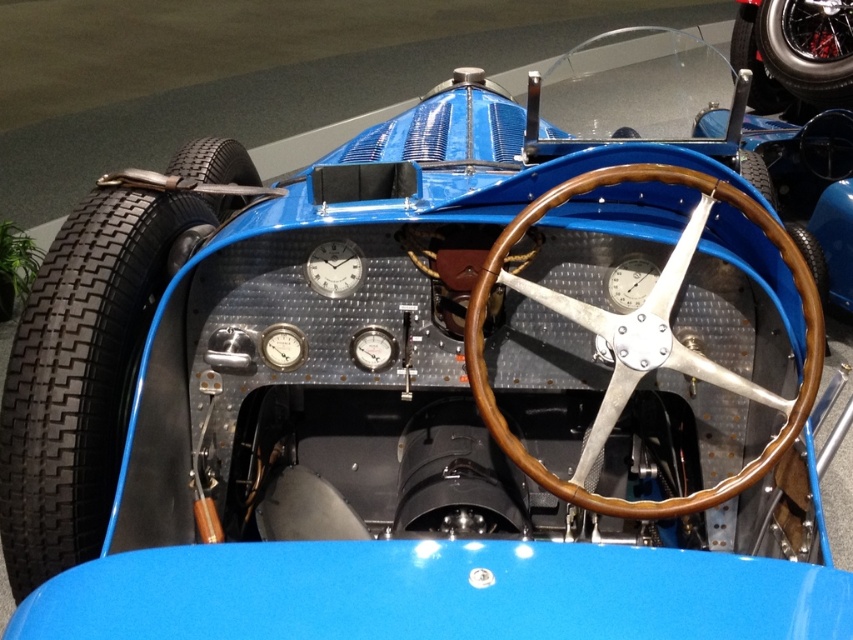
You are a mechanic inspecting the vintage racing car. You need to compare the widths of the black rubber tire at left and the shiny chrome wheel at upper right. Which one has a greater width?

The black rubber tire at left has a greater width than the shiny chrome wheel at upper right according to the description.